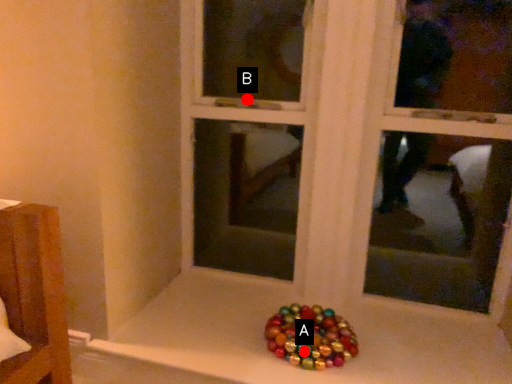
Question: Two points are circled on the image, labeled by A and B beside each circle. Which point is farther to the camera?

Choices:
 (A) A is further
 (B) B is further

Answer: (B)